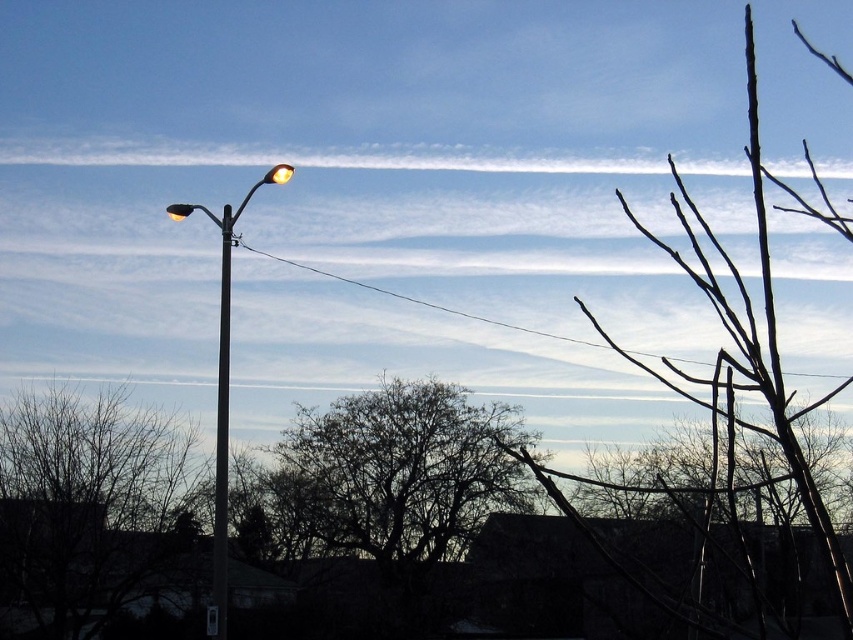
Can you confirm if brown bare branches at center is positioned above metallic street light at left?

No.

Which is in front, point (194, 461) or point (215, 586)?

Positioned in front is point (215, 586).

This screenshot has height=640, width=853. Describe the element at coordinates (90, 502) in the screenshot. I see `brown bare branches at center` at that location.

Locate an element on the screen. This screenshot has width=853, height=640. brown bare branches at center is located at coordinates (90, 502).

Find the location of `brown bare branches at center`. brown bare branches at center is located at coordinates (90, 502).

In the scene shown: Which is below, brown bare branches at center or matte yellow streetlight at upper center?

brown bare branches at center is below.

Measure the distance between point (155,488) and camera.

A distance of 34.06 meters exists between point (155,488) and camera.

Find the location of a particular element. Image resolution: width=853 pixels, height=640 pixels. brown bare branches at center is located at coordinates (90, 502).

Which is in front, point (271, 177) or point (186, 212)?

Point (271, 177) is more forward.

The image size is (853, 640). I want to click on matte yellow streetlight at upper center, so click(x=279, y=173).